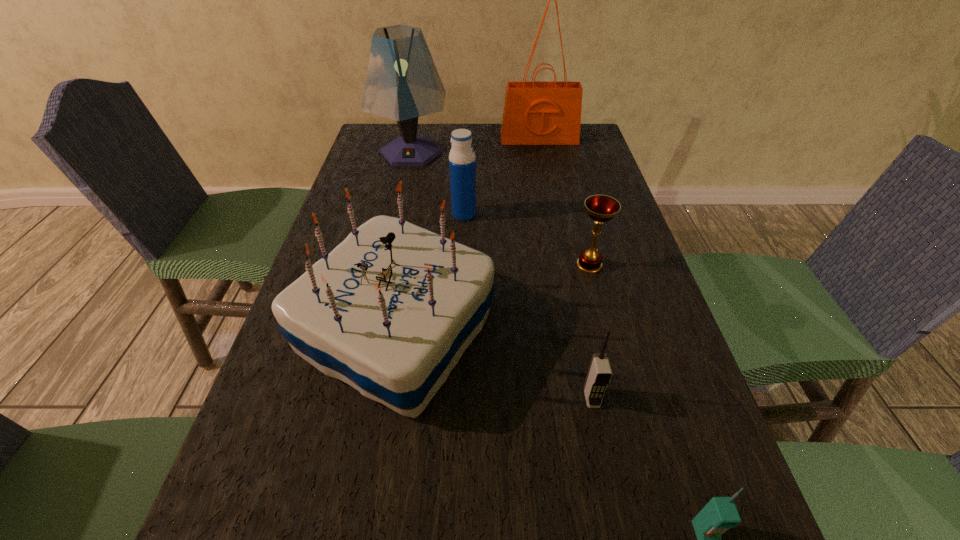
Locate an element on the screen. The height and width of the screenshot is (540, 960). object present at the far left corner is located at coordinates (402, 83).

At what (x,y) coordinates should I click in order to perform the action: click on object that is at the far right corner. Please return your answer as a coordinate pair (x, y). Looking at the image, I should click on (535, 113).

The image size is (960, 540). Identify the location of vacant space at the far edge of the desktop. (448, 137).

Locate an element on the screen. This screenshot has height=540, width=960. free space at the left edge is located at coordinates (296, 422).

Find the location of a particular element. vacant area at the right edge of the desktop is located at coordinates (667, 521).

In the image, there is a desktop. Where is `vacant space at the far left corner`? This screenshot has width=960, height=540. vacant space at the far left corner is located at coordinates (371, 147).

Locate an element on the screen. Image resolution: width=960 pixels, height=540 pixels. blank space at the far right corner of the desktop is located at coordinates (573, 150).

Where is `vacant area that lies between the taller cellular telephone and the fifth shortest object`? This screenshot has height=540, width=960. vacant area that lies between the taller cellular telephone and the fifth shortest object is located at coordinates (494, 364).

Identify the location of free space between the tallest object and the left cellular telephone. (565, 268).

Identify the location of free space between the chalice and the tote bag. Image resolution: width=960 pixels, height=540 pixels. (564, 202).